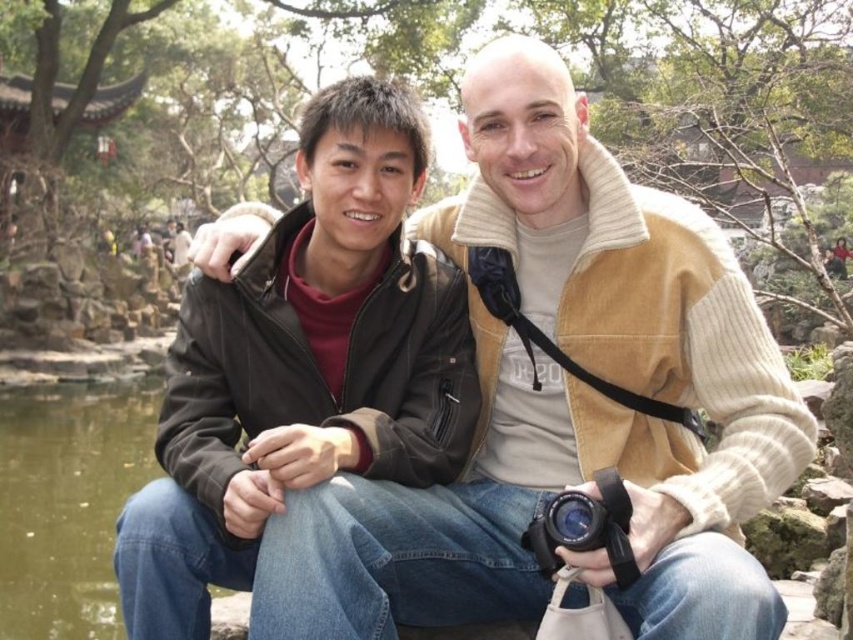
Does matte black jacket at center appear under greenish water at lower left?

No, matte black jacket at center is not below greenish water at lower left.

Find the location of a particular element. The height and width of the screenshot is (640, 853). matte black jacket at center is located at coordinates (564, 401).

Which is more to the left, matte black jacket at center or matte black jacket at left?

matte black jacket at left

Can you confirm if matte black jacket at center is taller than matte black jacket at left?

Correct, matte black jacket at center is much taller as matte black jacket at left.

Who is more forward, (x=755, y=378) or (x=379, y=129)?

Point (x=755, y=378) is in front.

Locate an element on the screen. This screenshot has height=640, width=853. matte black jacket at center is located at coordinates (564, 401).

Does greenish water at lower left have a larger size compared to black rubber camera at lower center?

Indeed, greenish water at lower left has a larger size compared to black rubber camera at lower center.

Does greenish water at lower left appear on the left side of black rubber camera at lower center?

Indeed, greenish water at lower left is positioned on the left side of black rubber camera at lower center.

Who is more forward, (82,436) or (573,541)?

Point (573,541) is more forward.

I want to click on greenish water at lower left, so click(x=68, y=502).